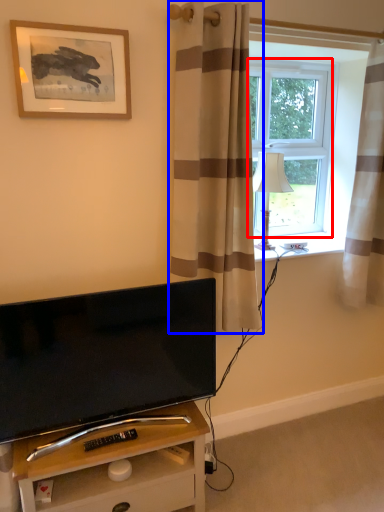
Question: Among these objects, which one is nearest to the camera, window screen (highlighted by a red box) or curtain (highlighted by a blue box)?

Choices:
 (A) window screen
 (B) curtain

Answer: (B)